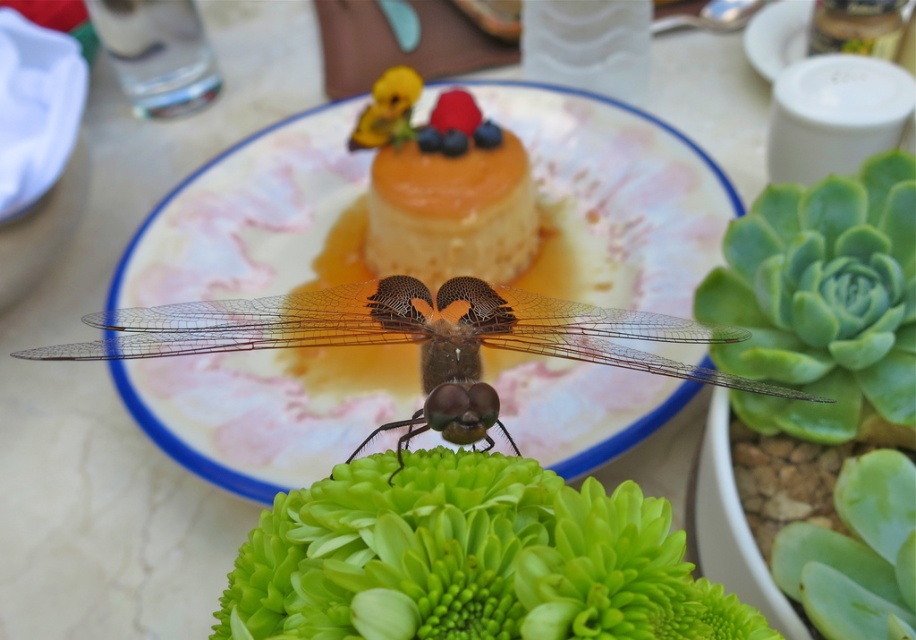
Who is taller, green matte flower at center or golden caramel flan at center?

A: With more height is golden caramel flan at center.

Does point (368, 490) lie behind point (431, 113)?

No, it is not.

Which is in front, point (322, 515) or point (384, 140)?

Positioned in front is point (322, 515).

At what (x,y) coordinates should I click in order to perform the action: click on green matte flower at center. Please return your answer as a coordinate pair (x, y). The width and height of the screenshot is (916, 640). Looking at the image, I should click on (470, 560).

Which is more to the left, translucent glass plate at center or golden caramel flan at center?

translucent glass plate at center

Find the location of a particular element. This screenshot has width=916, height=640. translucent glass plate at center is located at coordinates (609, 195).

Find the location of `green matte flower at center`. green matte flower at center is located at coordinates (470, 560).

How far apart are green matte flower at center and translucent brown dragonfly at center?

A distance of 4.75 inches exists between green matte flower at center and translucent brown dragonfly at center.

Is point (464, 508) closer to camera compared to point (453, 429)?

Yes, it is in front of point (453, 429).

At what (x,y) coordinates should I click in order to perform the action: click on green matte flower at center. Please return your answer as a coordinate pair (x, y). Looking at the image, I should click on (470, 560).